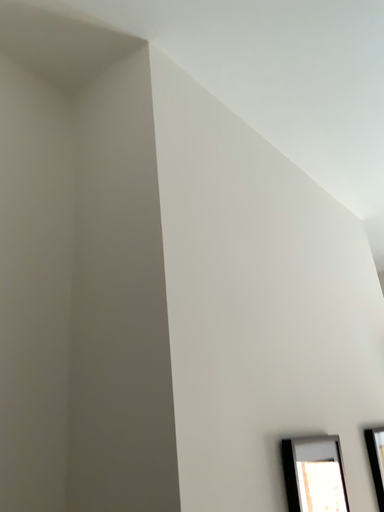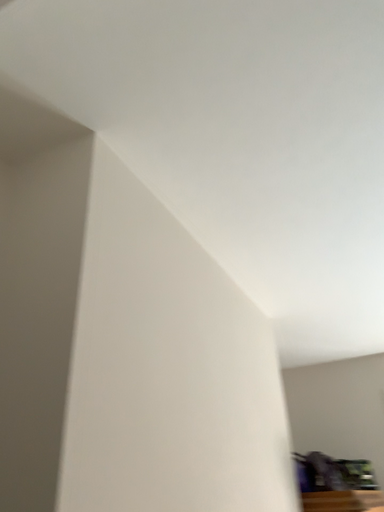
Question: How did the camera likely rotate when shooting the video?

Choices:
 (A) rotated downward
 (B) rotated upward

Answer: (B)